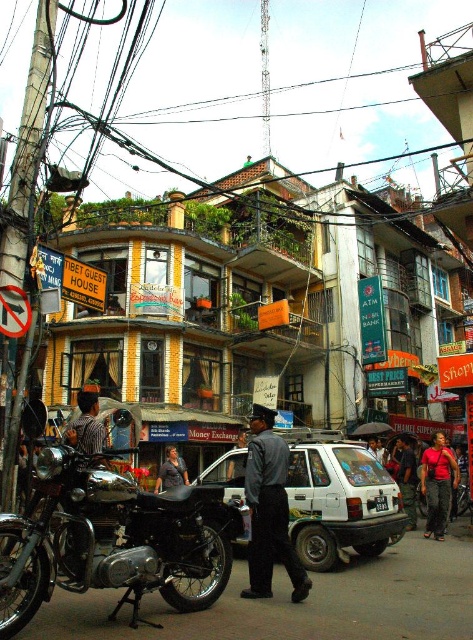
Question: Based on their relative distances, which object is nearer to the white matte car at center?

Choices:
 (A) shiny chrome motorcycle at center-left
 (B) dark blue uniform at center

Answer: (B)

Question: Which is farther from the white matte car at center?

Choices:
 (A) dark gray shirt at center
 (B) red fabric shirt at center
 (C) shiny chrome motorcycle at center-left
 (D) dark blue uniform at center

Answer: (A)

Question: Estimate the real-world distances between objects in this image. Which object is farther from the white matte car at center?

Choices:
 (A) shiny chrome motorcycle at center-left
 (B) dark gray shirt at center
 (C) red fabric shirt at center

Answer: (B)

Question: Is shiny chrome motorcycle at center-left closer to the viewer compared to dark gray shirt at center?

Choices:
 (A) yes
 (B) no

Answer: (A)

Question: Does dark blue uniform at center have a greater width compared to red fabric shirt at center?

Choices:
 (A) no
 (B) yes

Answer: (A)

Question: Where is white matte car at center located in relation to red fabric shirt at center in the image?

Choices:
 (A) above
 (B) below

Answer: (A)